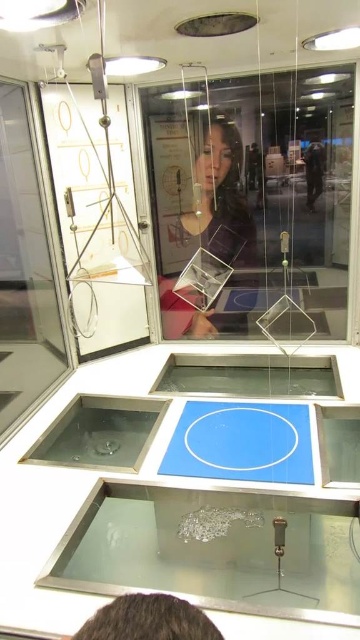
Question: Can you confirm if transparent glass at lower center is smaller than matte glass cube at center?

Choices:
 (A) yes
 (B) no

Answer: (A)

Question: Which point is farther to the camera?

Choices:
 (A) transparent glass at lower center
 (B) matte glass cube at center

Answer: (B)

Question: Which of the following is the farthest from the observer?

Choices:
 (A) (172, 323)
 (B) (325, 547)

Answer: (A)

Question: Does transparent glass at lower center appear over matte glass cube at center?

Choices:
 (A) yes
 (B) no

Answer: (B)

Question: Does transparent glass at lower center have a greater width compared to matte glass cube at center?

Choices:
 (A) yes
 (B) no

Answer: (A)